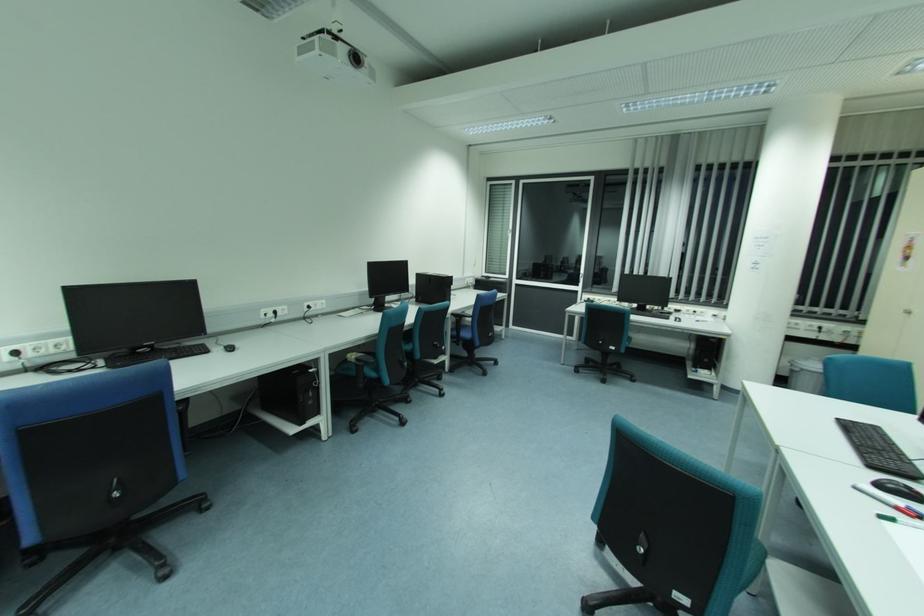
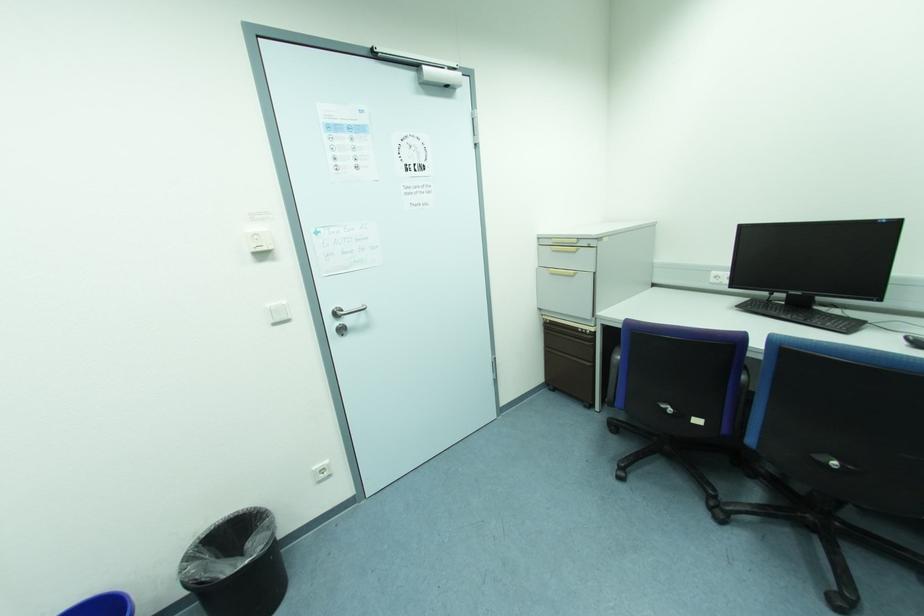
Based on the continuous images, in which direction is the camera rotating?

The camera's rotation is toward left-down.